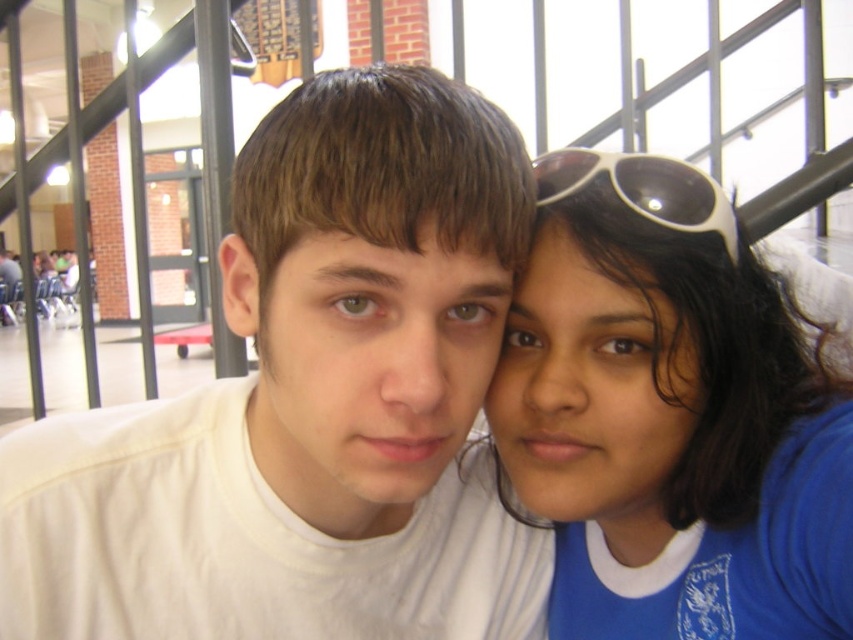
You are a photographer adjusting the camera focus. The blue fabric shirt at right and the white plastic sunglasses at upper right are both in the frame. How far apart are these two items in inches?

The blue fabric shirt at right is 5.50 inches from the white plastic sunglasses at upper right.